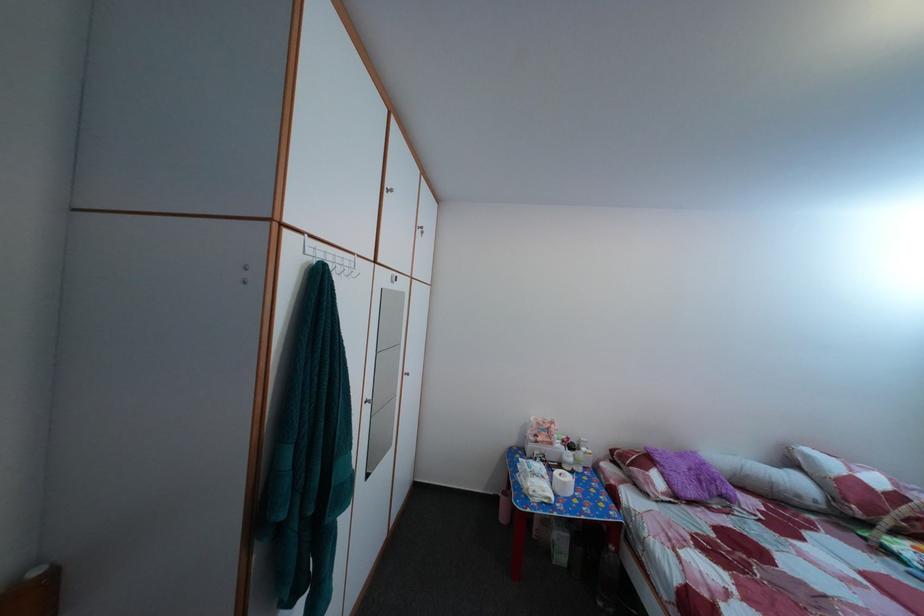
This screenshot has height=616, width=924. What do you see at coordinates (772, 482) in the screenshot?
I see `the white cylindrical pillow` at bounding box center [772, 482].